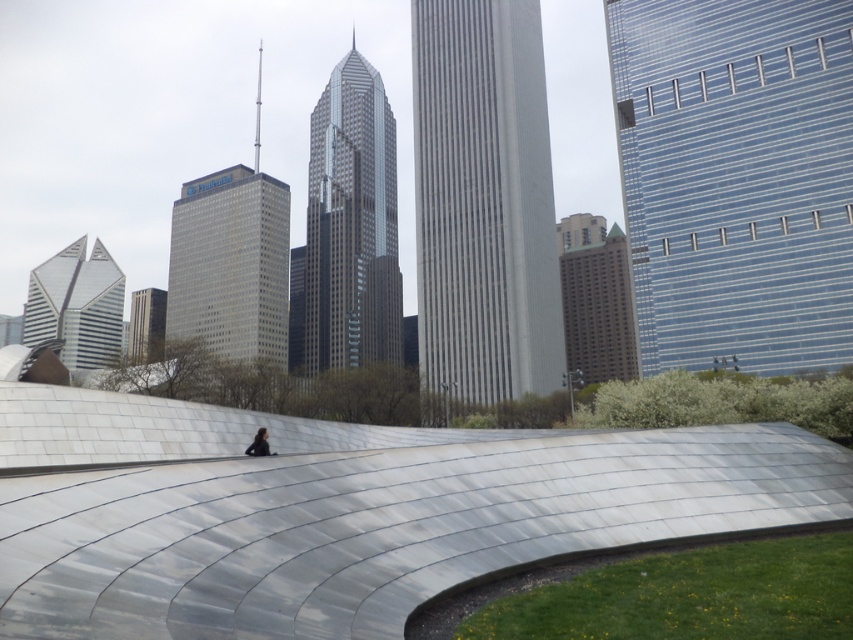
Question: Which object is farther from the camera taking this photo?

Choices:
 (A) shiny glass skyscraper at center
 (B) gray marble skyscraper at center
 (C) brown/marble-like hotel at center-right
 (D) blue glass skyscraper at upper right

Answer: (A)

Question: Which point is farther to the camera?

Choices:
 (A) shiny glass skyscraper at left
 (B) dark blue fabric at center
 (C) blue glass skyscraper at upper right
 (D) glassy reflective skyscraper at center

Answer: (C)

Question: Can you confirm if shiny glass skyscraper at center is bigger than glassy steel skyscraper at center?

Choices:
 (A) yes
 (B) no

Answer: (B)

Question: Among these objects, which one is nearest to the camera?

Choices:
 (A) silver metallic park at center
 (B) dark blue fabric at center

Answer: (A)

Question: Does glassy steel skyscraper at center lie in front of shiny glass skyscraper at left?

Choices:
 (A) no
 (B) yes

Answer: (B)

Question: Is blue glass skyscraper at upper right to the left of glassy reflective skyscraper at center from the viewer's perspective?

Choices:
 (A) no
 (B) yes

Answer: (A)